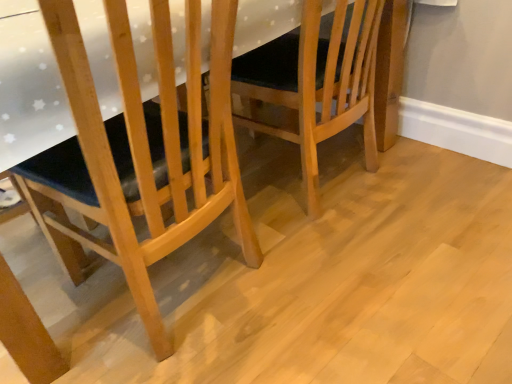
At what (x,y) coordinates should I click in order to perform the action: click on natural wood chair at left, the 2th chair from the right. Please return your answer as a coordinate pair (x, y). Looking at the image, I should click on click(x=140, y=152).

Measure the distance between point (181, 194) and camera.

The depth of point (181, 194) is 37.40 inches.

The width and height of the screenshot is (512, 384). Describe the element at coordinates (140, 152) in the screenshot. I see `natural wood chair at left, acting as the 1th chair starting from the left` at that location.

What do you see at coordinates (316, 82) in the screenshot?
I see `light brown wooden chair at center, which is the 1th chair from right to left` at bounding box center [316, 82].

This screenshot has height=384, width=512. In order to click on light brown wooden chair at center, which is the 1th chair from right to left in this screenshot , I will do `click(316, 82)`.

Where is `natural wood chair at left, acting as the 1th chair starting from the left`? natural wood chair at left, acting as the 1th chair starting from the left is located at coordinates coord(140,152).

Which object is positioned more to the left, natural wood chair at left, acting as the 1th chair starting from the left, or light brown wooden chair at center, which is the 1th chair from right to left?

From the viewer's perspective, natural wood chair at left, acting as the 1th chair starting from the left, appears more on the left side.

Which object is closer to the camera taking this photo, natural wood chair at left, the 2th chair from the right, or light brown wooden chair at center, placed as the second chair when sorted from left to right?

natural wood chair at left, the 2th chair from the right.

Which is closer, (41,160) or (306,161)?

The point (41,160) is closer to the camera.

From the image's perspective, which one is positioned lower, natural wood chair at left, the 2th chair from the right, or light brown wooden chair at center, which is the 1th chair from right to left?

From the image's view, natural wood chair at left, the 2th chair from the right, is below.

From a real-world perspective, is natural wood chair at left, the 2th chair from the right, physically below light brown wooden chair at center, placed as the second chair when sorted from left to right?

No, from a real-world perspective, natural wood chair at left, the 2th chair from the right, is not below light brown wooden chair at center, placed as the second chair when sorted from left to right.

Can you confirm if natural wood chair at left, acting as the 1th chair starting from the left, is wider than light brown wooden chair at center, placed as the second chair when sorted from left to right?

In fact, natural wood chair at left, acting as the 1th chair starting from the left, might be narrower than light brown wooden chair at center, placed as the second chair when sorted from left to right.

Between natural wood chair at left, the 2th chair from the right, and light brown wooden chair at center, which is the 1th chair from right to left, which one has more height?

Standing taller between the two is natural wood chair at left, the 2th chair from the right.

Between natural wood chair at left, acting as the 1th chair starting from the left, and light brown wooden chair at center, placed as the second chair when sorted from left to right, which one has larger size?

Bigger between the two is natural wood chair at left, acting as the 1th chair starting from the left.

Can light brown wooden chair at center, placed as the second chair when sorted from left to right, be found inside natural wood chair at left, the 2th chair from the right?

No.

Is natural wood chair at left, the 2th chair from the right, placed right next to light brown wooden chair at center, which is the 1th chair from right to left?

No, natural wood chair at left, the 2th chair from the right, is not beside light brown wooden chair at center, which is the 1th chair from right to left.

Based on the photo, is natural wood chair at left, acting as the 1th chair starting from the left, oriented away from light brown wooden chair at center, which is the 1th chair from right to left?

No.

Can you tell me how much natural wood chair at left, acting as the 1th chair starting from the left, and light brown wooden chair at center, which is the 1th chair from right to left, differ in facing direction?

7.97e-05 degrees.

In order to click on chair that appears above the natural wood chair at left, acting as the 1th chair starting from the left (from the image's perspective) in this screenshot , I will do `click(316, 82)`.

Is light brown wooden chair at center, which is the 1th chair from right to left, to the left or to the right of natural wood chair at left, acting as the 1th chair starting from the left, in the image?

light brown wooden chair at center, which is the 1th chair from right to left, is to the right of natural wood chair at left, acting as the 1th chair starting from the left.

In the image, is light brown wooden chair at center, which is the 1th chair from right to left, positioned in front of or behind natural wood chair at left, acting as the 1th chair starting from the left?

In the image, light brown wooden chair at center, which is the 1th chair from right to left, appears behind natural wood chair at left, acting as the 1th chair starting from the left.

Is point (308, 169) closer or farther from the camera than point (116, 123)?

Point (308, 169) appears to be farther away from the viewer than point (116, 123).

From the image's perspective, relative to natural wood chair at left, acting as the 1th chair starting from the left, is light brown wooden chair at center, which is the 1th chair from right to left, above or below?

light brown wooden chair at center, which is the 1th chair from right to left, is above natural wood chair at left, acting as the 1th chair starting from the left.

From a real-world perspective, who is located lower, light brown wooden chair at center, which is the 1th chair from right to left, or natural wood chair at left, the 2th chair from the right?

light brown wooden chair at center, which is the 1th chair from right to left, from a real-world perspective.

Is light brown wooden chair at center, which is the 1th chair from right to left, thinner than natural wood chair at left, the 2th chair from the right?

Incorrect, the width of light brown wooden chair at center, which is the 1th chair from right to left, is not less than that of natural wood chair at left, the 2th chair from the right.

Considering the relative sizes of light brown wooden chair at center, which is the 1th chair from right to left, and natural wood chair at left, acting as the 1th chair starting from the left, in the image provided, is light brown wooden chair at center, which is the 1th chair from right to left, shorter than natural wood chair at left, acting as the 1th chair starting from the left,?

Yes.

Looking at the image, does light brown wooden chair at center, placed as the second chair when sorted from left to right, seem bigger or smaller compared to natural wood chair at left, acting as the 1th chair starting from the left?

In the image, light brown wooden chair at center, placed as the second chair when sorted from left to right, appears to be smaller than natural wood chair at left, acting as the 1th chair starting from the left.

Would you say light brown wooden chair at center, placed as the second chair when sorted from left to right, is outside natural wood chair at left, acting as the 1th chair starting from the left?

Yes, light brown wooden chair at center, placed as the second chair when sorted from left to right, is outside of natural wood chair at left, acting as the 1th chair starting from the left.

Are light brown wooden chair at center, placed as the second chair when sorted from left to right, and natural wood chair at left, acting as the 1th chair starting from the left, located far from each other?

No, light brown wooden chair at center, placed as the second chair when sorted from left to right, is in close proximity to natural wood chair at left, acting as the 1th chair starting from the left.

Could you tell me if light brown wooden chair at center, placed as the second chair when sorted from left to right, is facing natural wood chair at left, the 2th chair from the right?

No, light brown wooden chair at center, placed as the second chair when sorted from left to right, does not turn towards natural wood chair at left, the 2th chair from the right.

Consider the image. How different are the orientations of light brown wooden chair at center, which is the 1th chair from right to left, and natural wood chair at left, the 2th chair from the right, in degrees?

light brown wooden chair at center, which is the 1th chair from right to left, and natural wood chair at left, the 2th chair from the right, are facing 7.97e-05 degrees away from each other.

Locate an element on the screen. This screenshot has height=384, width=512. chair that appears on the left of light brown wooden chair at center, which is the 1th chair from right to left is located at coordinates (140, 152).

This screenshot has width=512, height=384. Identify the location of chair in front of the light brown wooden chair at center, which is the 1th chair from right to left. (140, 152).

Locate an element on the screen. The height and width of the screenshot is (384, 512). chair below the natural wood chair at left, the 2th chair from the right (from a real-world perspective) is located at coordinates (316, 82).